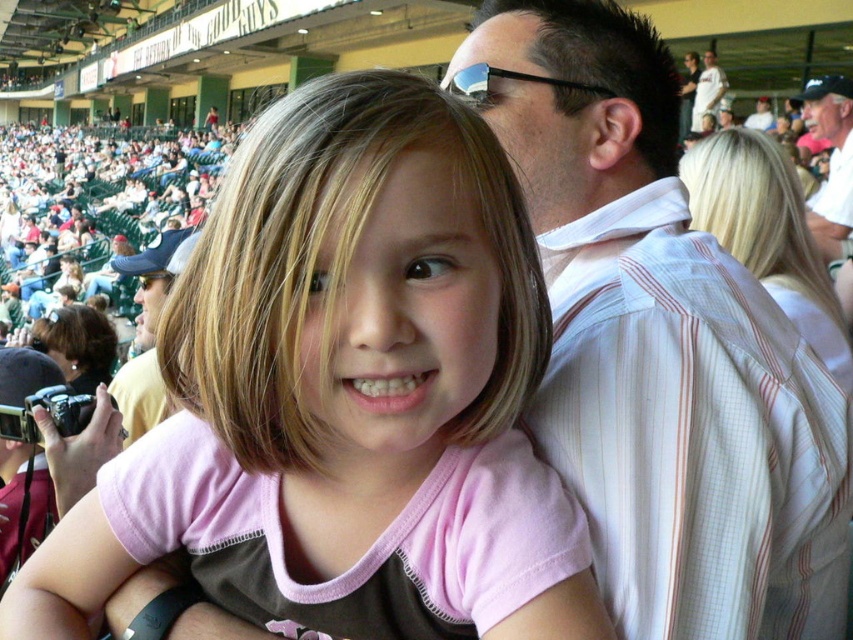
Question: Which of the following is the closest to the observer?

Choices:
 (A) matte white shirt at center
 (B) white striped shirt at upper right

Answer: (B)

Question: Is pink fabric shirt at center closer to camera compared to matte green seats at upper left?

Choices:
 (A) yes
 (B) no

Answer: (A)

Question: Does white pinstriped shirt at upper right have a smaller size compared to white striped shirt at upper center?

Choices:
 (A) no
 (B) yes

Answer: (A)

Question: Which point appears farthest from the camera in this image?

Choices:
 (A) tap(410, 292)
 (B) tap(593, 269)
 (C) tap(163, 182)

Answer: (C)

Question: Which of these objects is positioned farthest from the white pinstriped shirt at upper right?

Choices:
 (A) matte green seats at upper left
 (B) white striped shirt at upper right

Answer: (A)

Question: Does white striped shirt at upper right have a larger size compared to white striped shirt at upper center?

Choices:
 (A) yes
 (B) no

Answer: (B)